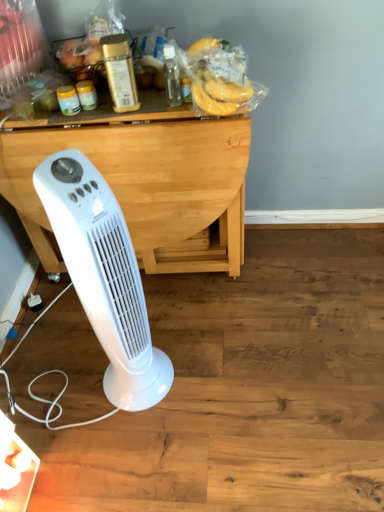
Question: Could you tell me if white plastic tower fan at lower left is facing wooden table at center?

Choices:
 (A) yes
 (B) no

Answer: (B)

Question: Does white plastic tower fan at lower left have a lesser width compared to wooden table at center?

Choices:
 (A) no
 (B) yes

Answer: (B)

Question: Considering the relative positions of white plastic tower fan at lower left and wooden table at center in the image provided, is white plastic tower fan at lower left to the left of wooden table at center from the viewer's perspective?

Choices:
 (A) no
 (B) yes

Answer: (A)

Question: From a real-world perspective, is white plastic tower fan at lower left beneath wooden table at center?

Choices:
 (A) yes
 (B) no

Answer: (B)

Question: Is white plastic tower fan at lower left smaller than wooden table at center?

Choices:
 (A) no
 (B) yes

Answer: (B)

Question: Is wooden table at center surrounded by white plastic tower fan at lower left?

Choices:
 (A) yes
 (B) no

Answer: (B)

Question: Is yellow matte bananas at upper center with transparent plastic bottle at center, which ranks as the first bottle in right-to-left order?

Choices:
 (A) no
 (B) yes

Answer: (A)

Question: Can you confirm if yellow matte bananas at upper center is taller than transparent plastic bottle at center, which ranks as the first bottle in right-to-left order?

Choices:
 (A) no
 (B) yes

Answer: (A)

Question: Does yellow matte bananas at upper center have a larger size compared to transparent plastic bottle at center, which is the 2th bottle in left-to-right order?

Choices:
 (A) yes
 (B) no

Answer: (A)

Question: Is yellow matte bananas at upper center thinner than transparent plastic bottle at center, which ranks as the first bottle in right-to-left order?

Choices:
 (A) yes
 (B) no

Answer: (B)

Question: Is transparent plastic bottle at center, which is the 2th bottle in left-to-right order, a part of yellow matte bananas at upper center?

Choices:
 (A) no
 (B) yes

Answer: (A)

Question: Is yellow matte bananas at upper center positioned in front of transparent plastic bottle at center, which is the 2th bottle in left-to-right order?

Choices:
 (A) no
 (B) yes

Answer: (B)

Question: Is wooden table at center outside yellow matte bananas at upper center?

Choices:
 (A) yes
 (B) no

Answer: (A)